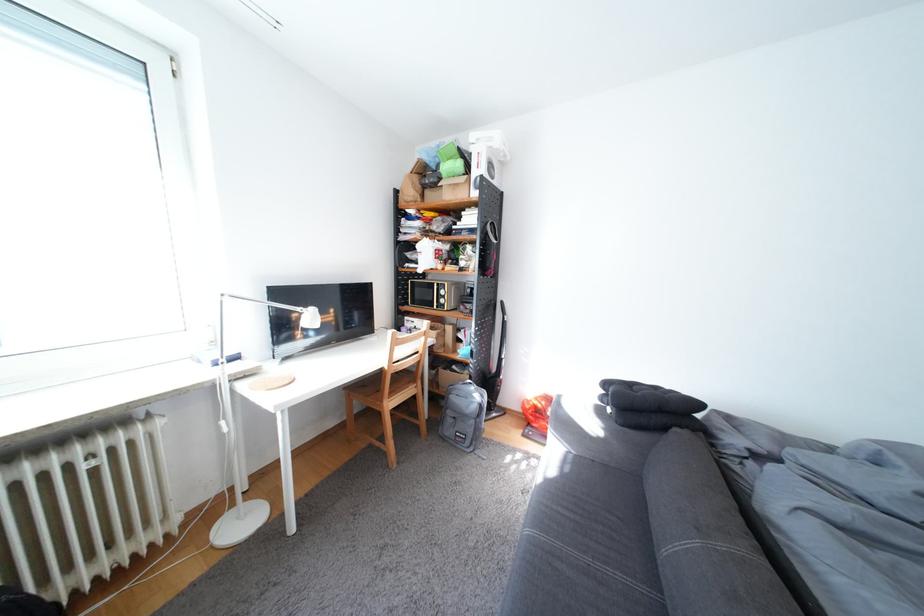
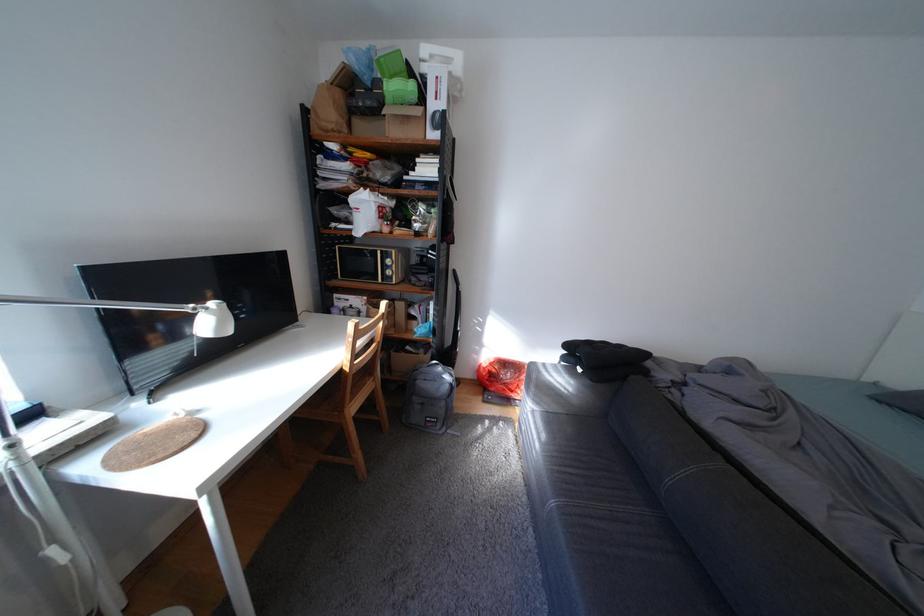
In the second image, find the point that corresponds to pixel 448 286 in the first image.

(392, 253)